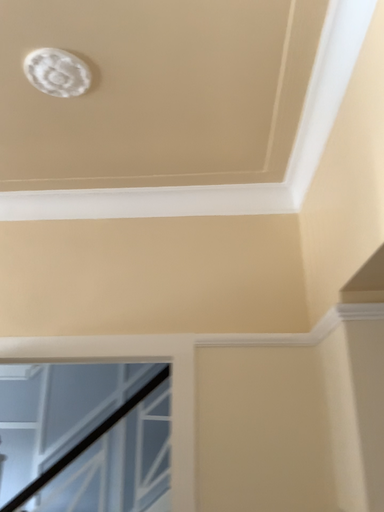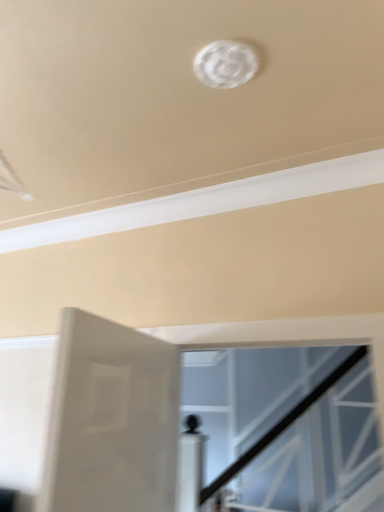
Question: How did the camera likely rotate when shooting the video?

Choices:
 (A) rotated right
 (B) rotated left

Answer: (B)